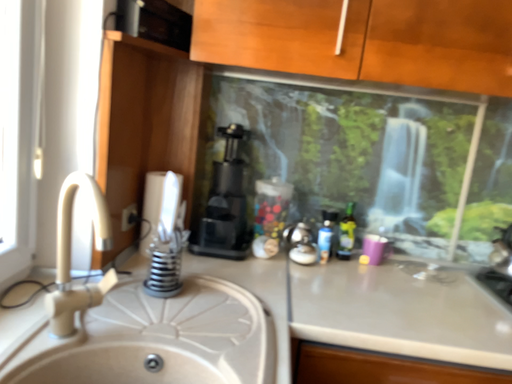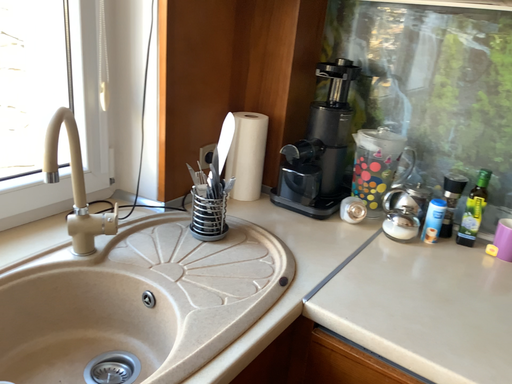
Question: How did the camera likely rotate when shooting the video?

Choices:
 (A) rotated upward
 (B) rotated downward

Answer: (B)